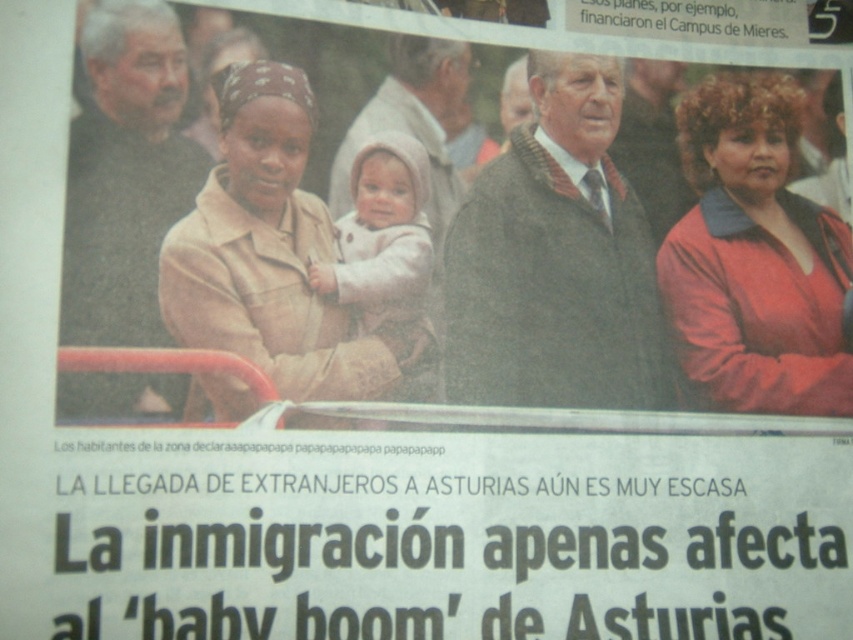
Question: Can you confirm if beige fabric jacket at center is positioned above light beige fabric baby at center?

Choices:
 (A) no
 (B) yes

Answer: (B)

Question: Among these points, which one is nearest to the camera?

Choices:
 (A) (724, 108)
 (B) (372, 273)
 (C) (305, 364)

Answer: (C)

Question: Which object is farther from the camera taking this photo?

Choices:
 (A) matte red sweater at right
 (B) light beige fabric baby at center

Answer: (A)

Question: Which object appears farthest from the camera in this image?

Choices:
 (A) beige fabric jacket at center
 (B) light beige fabric baby at center

Answer: (B)

Question: Is matte red sweater at right positioned in front of beige fabric jacket at center?

Choices:
 (A) yes
 (B) no

Answer: (B)

Question: Is matte red sweater at right below light beige fabric baby at center?

Choices:
 (A) no
 (B) yes

Answer: (A)